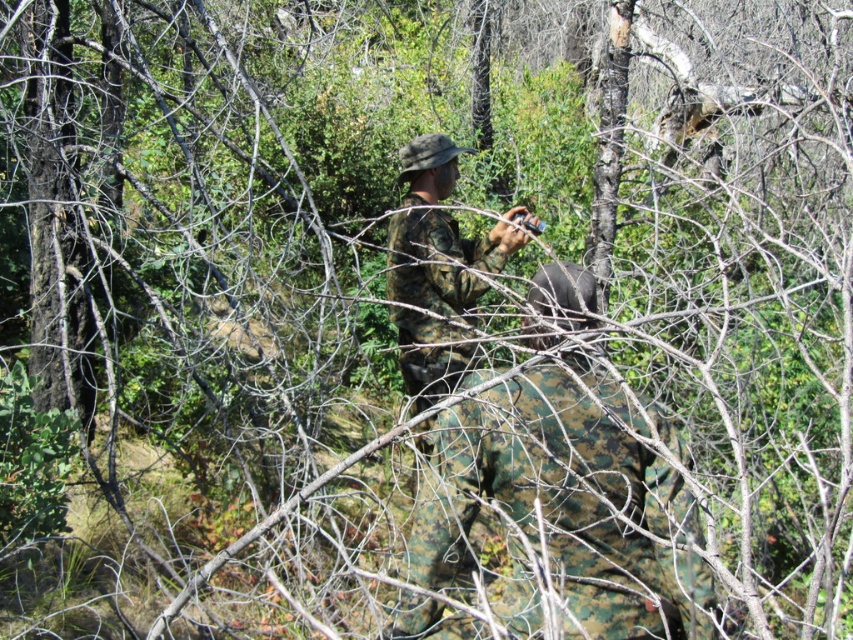
Question: Which point is closer to the camera?

Choices:
 (A) camouflage fabric uniform at center
 (B) camo fabric uniform at center

Answer: (B)

Question: From the image, what is the correct spatial relationship of camo fabric uniform at center in relation to camouflage fabric uniform at center?

Choices:
 (A) left
 (B) right

Answer: (B)

Question: Which point is closer to the camera?

Choices:
 (A) camo fabric uniform at center
 (B) camouflage fabric uniform at center

Answer: (A)

Question: Is camo fabric uniform at center to the right of camouflage fabric uniform at center from the viewer's perspective?

Choices:
 (A) no
 (B) yes

Answer: (B)

Question: Can you confirm if camo fabric uniform at center is positioned below camouflage fabric uniform at center?

Choices:
 (A) yes
 (B) no

Answer: (A)